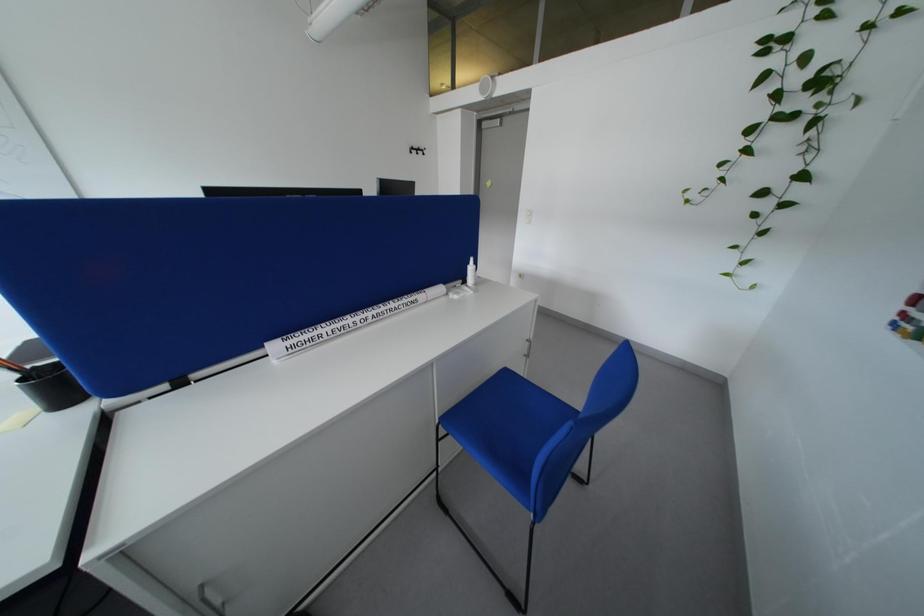
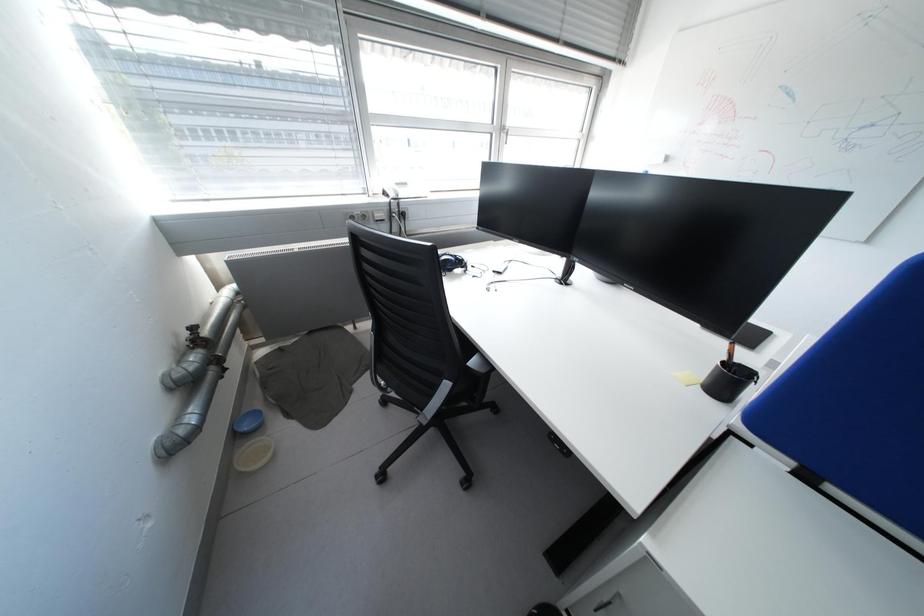
How did the camera likely rotate?

The rotation direction of the camera is left-down.